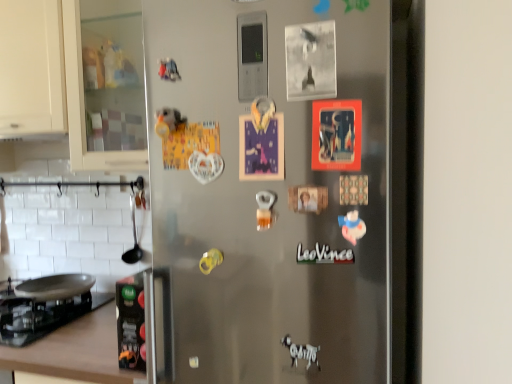
Question: Are matte white text at center and satin silver fridge at center far apart?

Choices:
 (A) yes
 (B) no

Answer: (B)

Question: Is matte white text at center positioned beyond the bounds of satin silver fridge at center?

Choices:
 (A) no
 (B) yes

Answer: (A)

Question: Is satin silver fridge at center at the back of matte white text at center?

Choices:
 (A) yes
 (B) no

Answer: (A)

Question: Considering the relative sizes of matte white text at center and satin silver fridge at center in the image provided, is matte white text at center smaller than satin silver fridge at center?

Choices:
 (A) yes
 (B) no

Answer: (A)

Question: From a real-world perspective, is matte white text at center located beneath satin silver fridge at center?

Choices:
 (A) no
 (B) yes

Answer: (B)

Question: In terms of width, does satin silver fridge at center look wider or thinner when compared to matte white text at center?

Choices:
 (A) wide
 (B) thin

Answer: (A)

Question: From a real-world perspective, is satin silver fridge at center physically located above or below matte white text at center?

Choices:
 (A) above
 (B) below

Answer: (A)

Question: Visually, is satin silver fridge at center positioned to the left or to the right of matte white text at center?

Choices:
 (A) right
 (B) left

Answer: (B)

Question: Is satin silver fridge at center in front of or behind matte white text at center in the image?

Choices:
 (A) front
 (B) behind

Answer: (A)

Question: From a real-world perspective, is brown wood countertop at lower left above or below black glass gas stove at lower left?

Choices:
 (A) below
 (B) above

Answer: (A)

Question: From the image's perspective, is brown wood countertop at lower left located above or below black glass gas stove at lower left?

Choices:
 (A) below
 (B) above

Answer: (A)

Question: Is point (52, 337) closer or farther from the camera than point (1, 312)?

Choices:
 (A) closer
 (B) farther

Answer: (A)

Question: Looking at their shapes, would you say brown wood countertop at lower left is wider or thinner than black glass gas stove at lower left?

Choices:
 (A) thin
 (B) wide

Answer: (B)

Question: From the image's perspective, is matte white text at center above or below satin silver fridge at center?

Choices:
 (A) above
 (B) below

Answer: (B)

Question: Is matte white text at center in front of or behind satin silver fridge at center in the image?

Choices:
 (A) front
 (B) behind

Answer: (B)